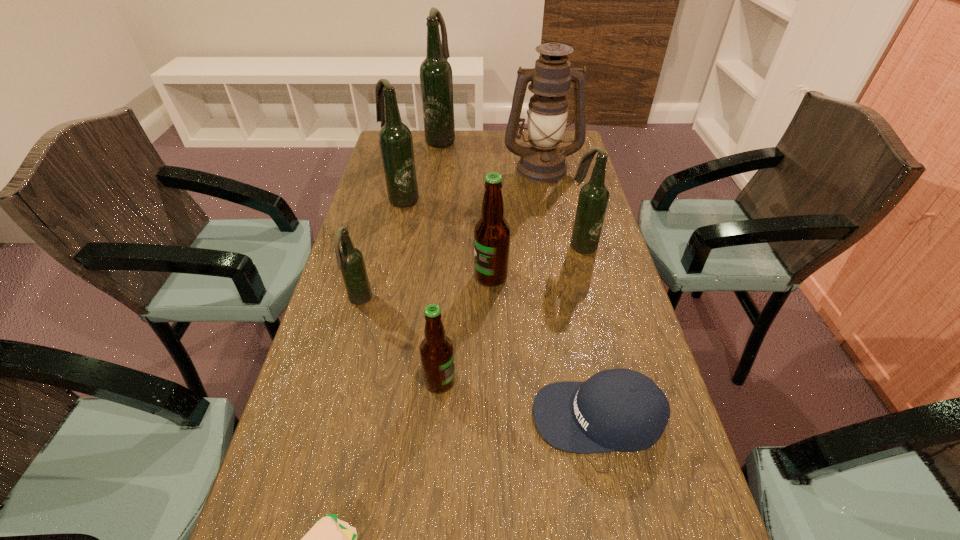
The width and height of the screenshot is (960, 540). What are the coordinates of `dark beer bottle that stands as the third closest to the third smallest dark beer bottle` in the screenshot? It's located at (593, 199).

I want to click on vacant position in the image that satisfies the following two spatial constraints: 1. on the front side of the oil lamp; 2. on the label of the smaller brown beer bottle, so click(583, 381).